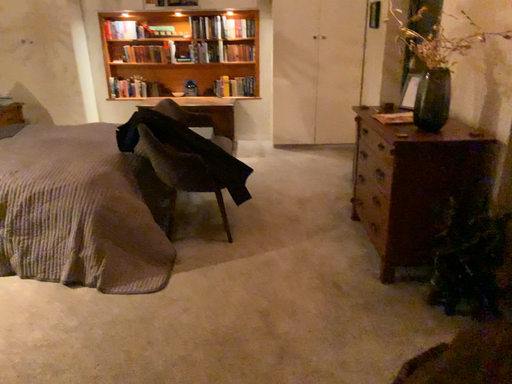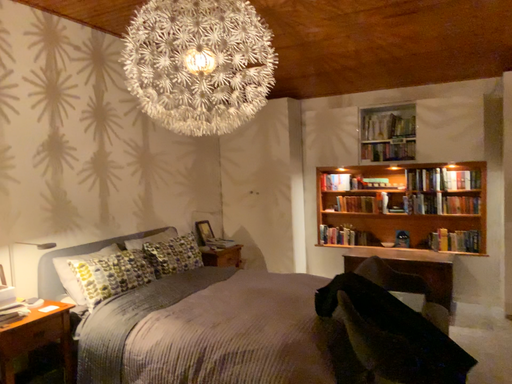
Question: Which way did the camera rotate in the video?

Choices:
 (A) rotated right
 (B) rotated left

Answer: (B)